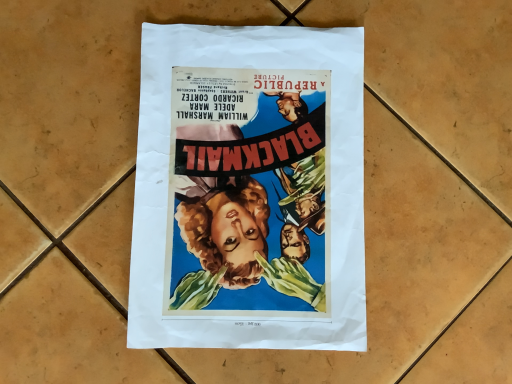
Image resolution: width=512 pixels, height=384 pixels. What are the coordinates of `blank space above matte paper poster at center (from a real-world perspective)` in the screenshot? It's located at (250, 180).